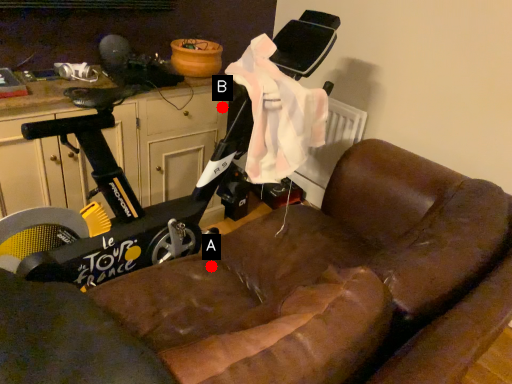
Question: Two points are circled on the image, labeled by A and B beside each circle. Which point is closer to the camera?

Choices:
 (A) A is closer
 (B) B is closer

Answer: (A)